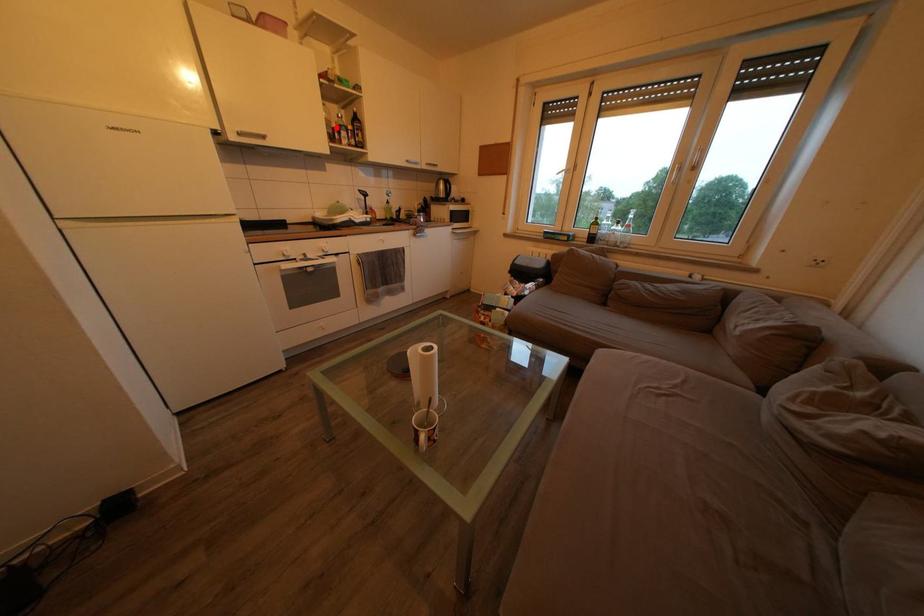
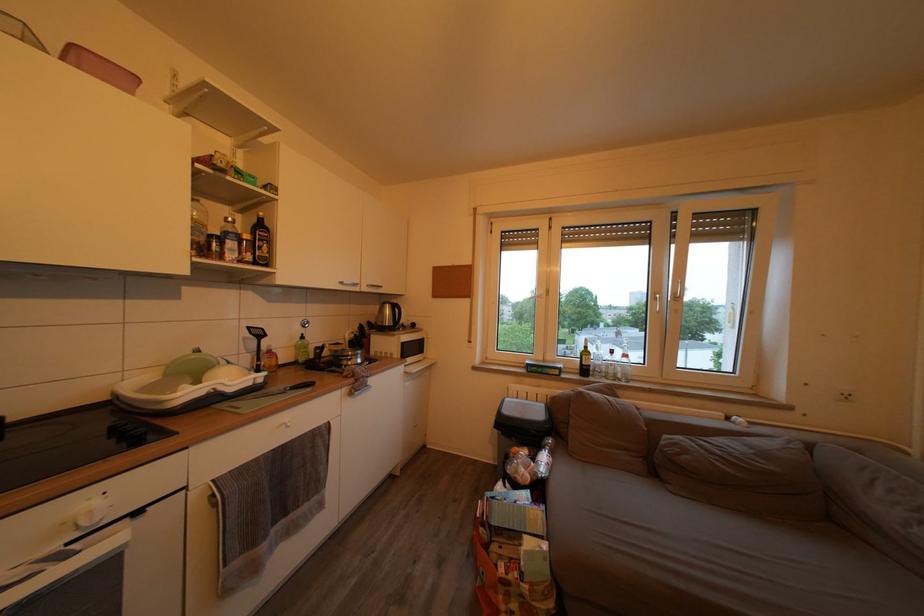
The point at the highlighted location is marked in the first image. Where is the corresponding point in the second image?

(205, 230)